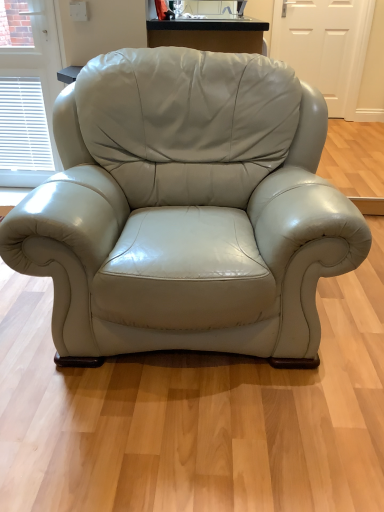
Describe the element at coordinates (28, 91) in the screenshot. I see `white blinds at left` at that location.

Image resolution: width=384 pixels, height=512 pixels. Find the location of `white blinds at left`. white blinds at left is located at coordinates (28, 91).

Based on the photo, measure the distance between point (40,19) and camera.

The depth of point (40,19) is 2.27 meters.

At what (x,y) coordinates should I click in order to perform the action: click on white blinds at left. Please return your answer as a coordinate pair (x, y). Looking at the image, I should click on (28, 91).